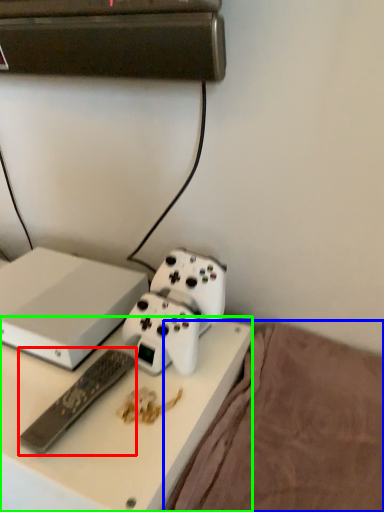
Question: Estimate the real-world distances between objects in this image. Which object is closer to remote control (highlighted by a red box), bedding (highlighted by a blue box) or desk (highlighted by a green box)?

Choices:
 (A) bedding
 (B) desk

Answer: (B)